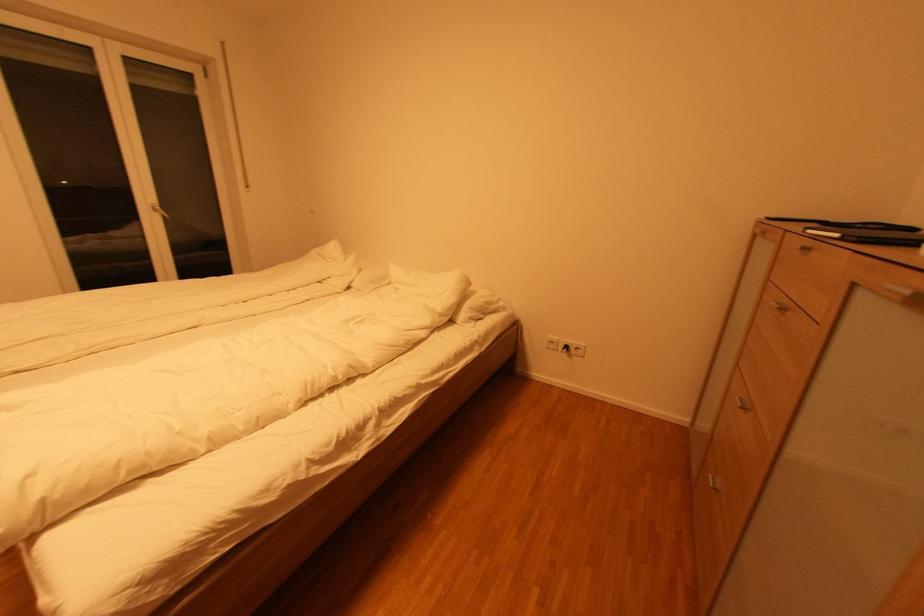
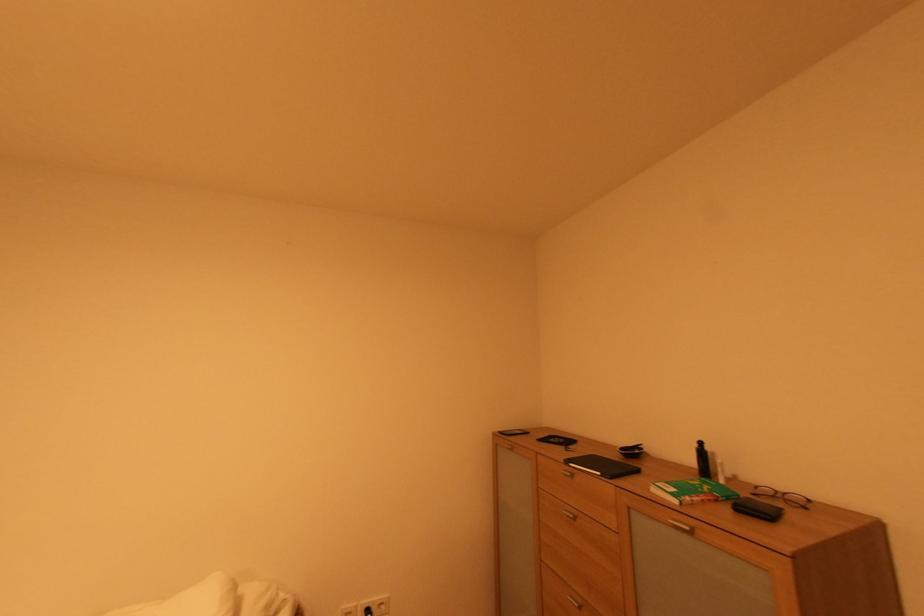
Locate, in the second image, the point that corresponds to point (843, 236) in the first image.

(604, 475)